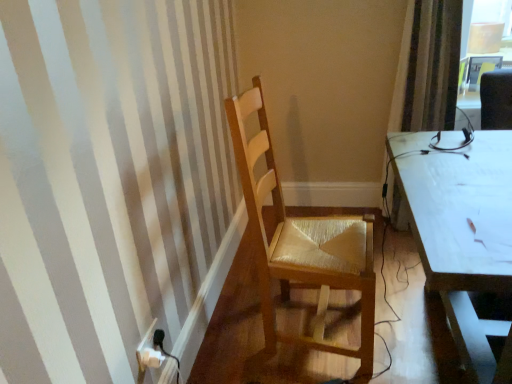
Question: Considering the positions of light brown wood chair at center and white plastic power plugs and sockets at lower left in the image, is light brown wood chair at center taller or shorter than white plastic power plugs and sockets at lower left?

Choices:
 (A) short
 (B) tall

Answer: (B)

Question: Looking at their shapes, would you say light brown wood chair at center is wider or thinner than white plastic power plugs and sockets at lower left?

Choices:
 (A) wide
 (B) thin

Answer: (A)

Question: Estimate the real-world distances between objects in this image. Which object is farther from the striped fabric curtain at right?

Choices:
 (A) light brown wood chair at center
 (B) white plastic power plugs and sockets at lower left

Answer: (B)

Question: Which object is the closest to the white plastic power plugs and sockets at lower left?

Choices:
 (A) light brown wood chair at center
 (B) striped fabric curtain at right

Answer: (A)